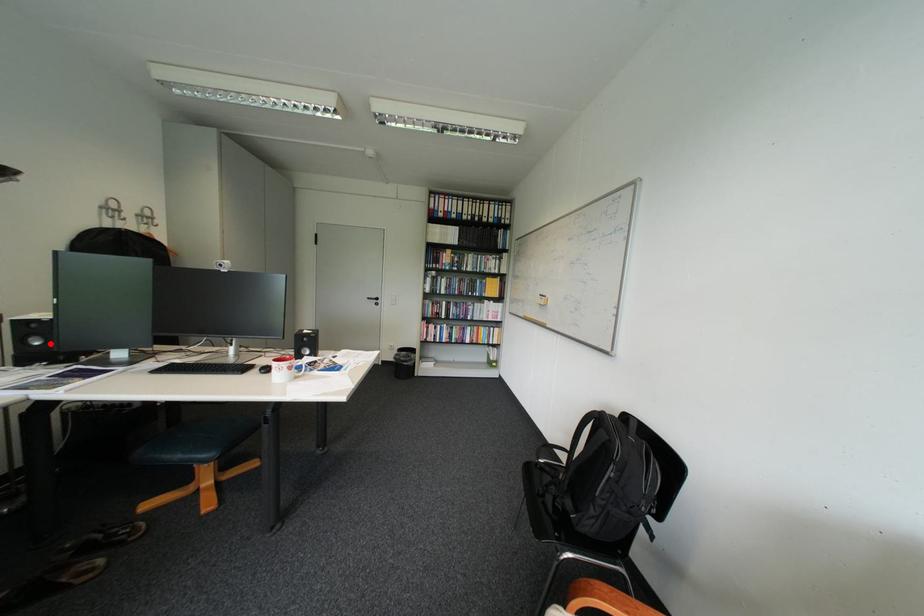
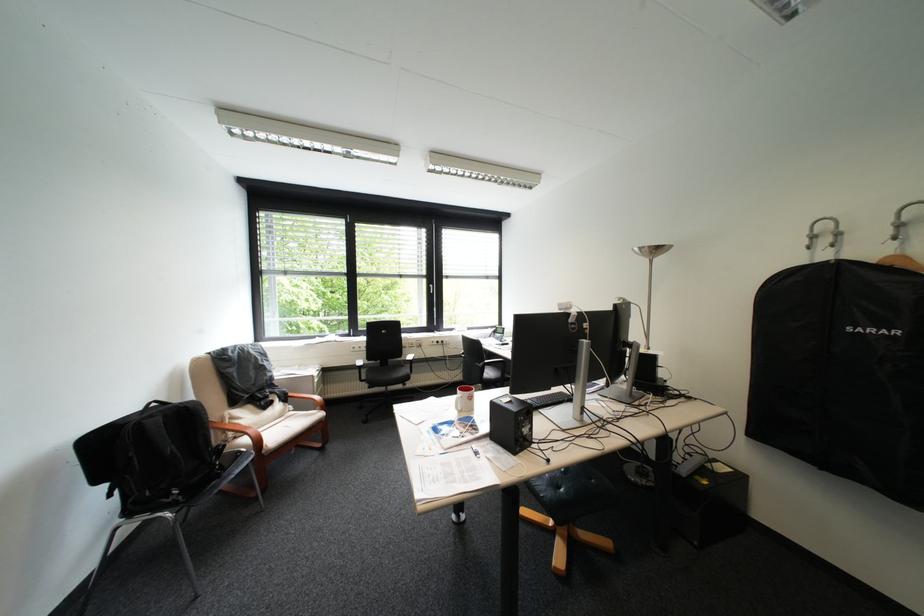
Question: I am providing you with two images of the same scene from different viewpoints. A red point is marked on the first image. Can you still see the location of the red point in image 2?

Choices:
 (A) Yes
 (B) No

Answer: (B)